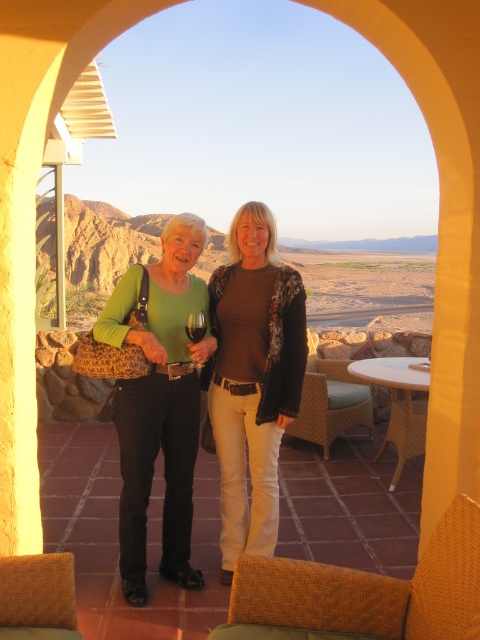
Question: Which object is positioned farthest from the brown matte sweater at center?

Choices:
 (A) translucent glass wine at center
 (B) transparent glass at center
 (C) matte green sweater at center

Answer: (A)

Question: Considering the real-world distances, which object is farthest from the brown matte sweater at center?

Choices:
 (A) transparent glass at center
 (B) matte green sweater at center
 (C) translucent glass wine at center

Answer: (C)

Question: Which object is the farthest from the matte green sweater at center?

Choices:
 (A) transparent glass at center
 (B) translucent glass wine at center

Answer: (B)

Question: Is transparent glass at center to the right of translucent glass wine at center from the viewer's perspective?

Choices:
 (A) yes
 (B) no

Answer: (A)

Question: Does matte green sweater at center have a lesser width compared to transparent glass at center?

Choices:
 (A) yes
 (B) no

Answer: (B)

Question: Does transparent glass at center appear on the right side of translucent glass wine at center?

Choices:
 (A) no
 (B) yes

Answer: (B)